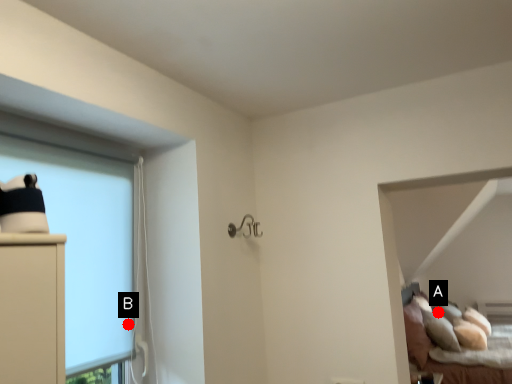
Question: Two points are circled on the image, labeled by A and B beside each circle. Which of the following is the farthest from the observer?

Choices:
 (A) A is further
 (B) B is further

Answer: (A)